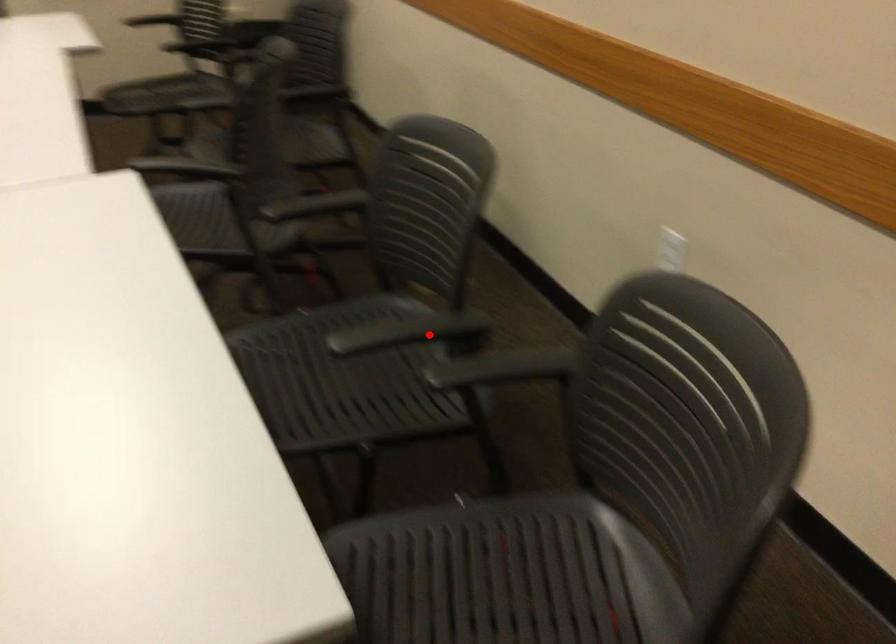
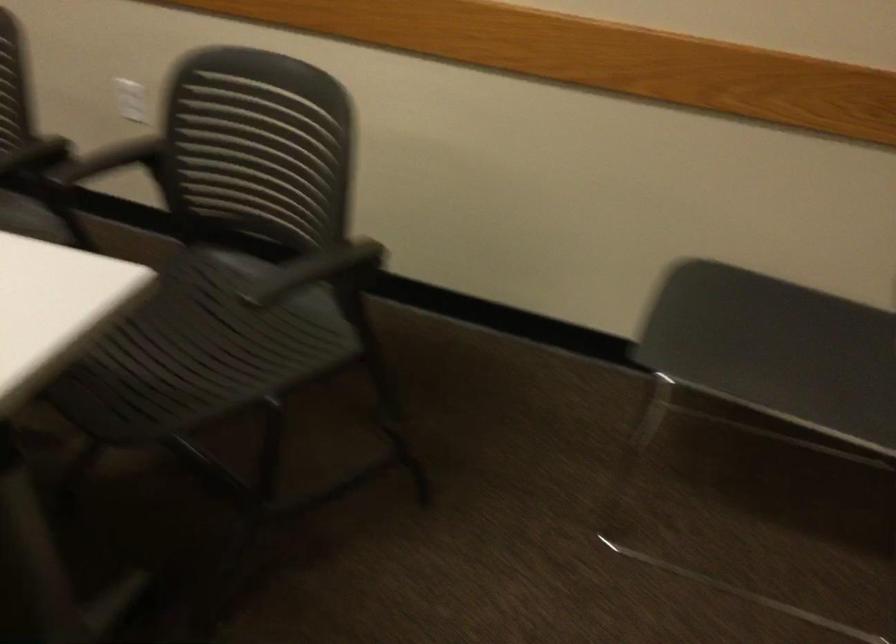
Question: I am providing you with two images of the same scene from different viewpoints. In image1, a red point is highlighted. Considering the same 3D point in image2, which of the following is correct?

Choices:
 (A) It is closer
 (B) It is farther

Answer: (B)